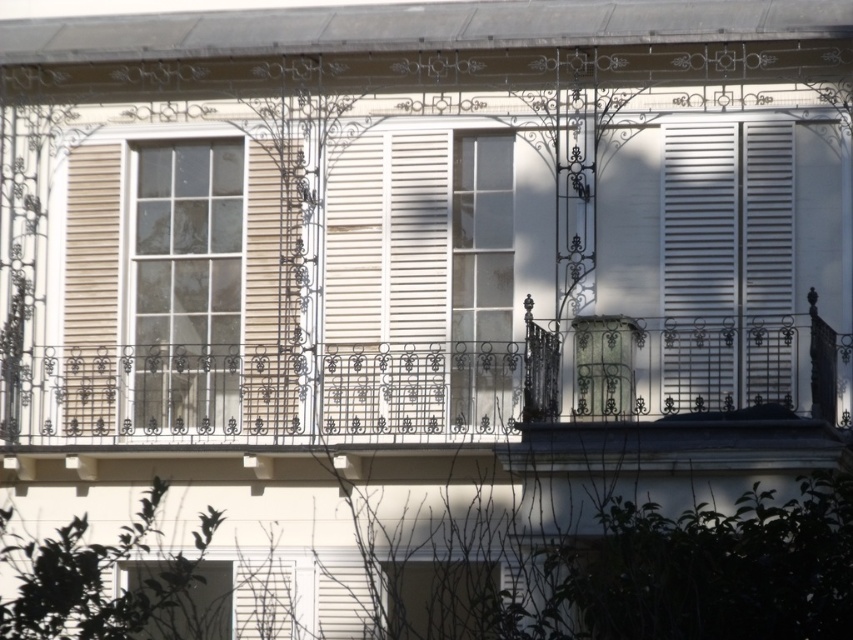
You are an architect reviewing the building facade. You need to determine which object, the white matte shutters at right or the white glass window at center, has a greater height. Based on the provided scene description, which one is taller?

The white glass window at center is taller than the white matte shutters at right.

You are standing in front of the building and notice the white matte shutter at center and the beige matte shutter at left. Which shutter is closer to you?

The white matte shutter at center is closer to you because it is in front of the beige matte shutter at left.

You are a painter standing at the base of the building and need to paint both the white matte shutter at center and the white matte shutter at right. Your ladder can extend up to 8 meters. Can you safely reach both shutters with your current ladder without moving it?

The distance between the white matte shutter at center and the white matte shutter at right is 8.45 meters. Since your ladder can only extend up to 8 meters, you cannot safely reach both shutters without moving the ladder because the distance exceeds the ladder length.